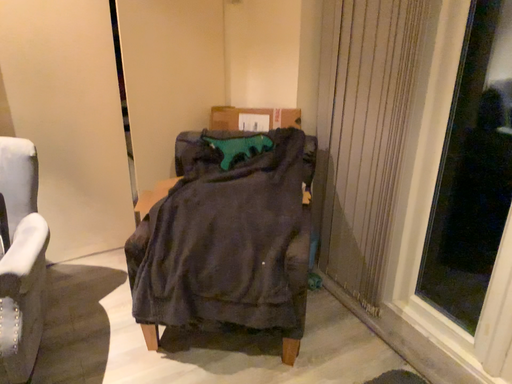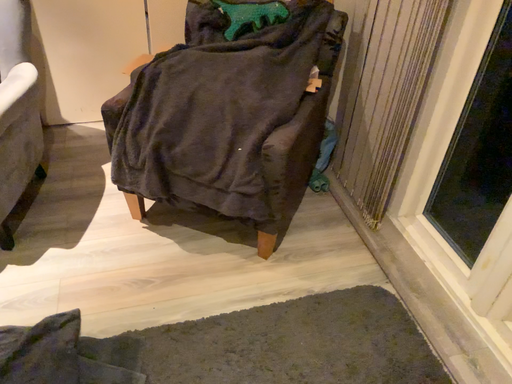
Question: Which way did the camera rotate in the video?

Choices:
 (A) rotated downward
 (B) rotated upward

Answer: (A)